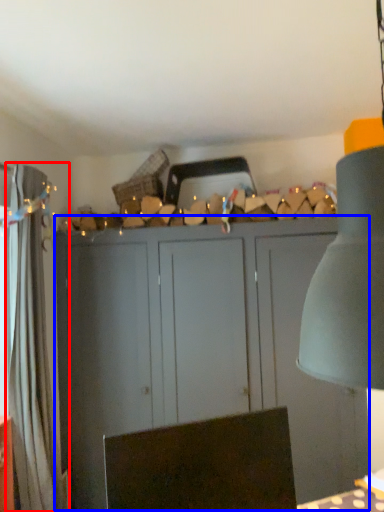
Question: Which object is further to the camera taking this photo, curtain (highlighted by a red box) or cupboard (highlighted by a blue box)?

Choices:
 (A) curtain
 (B) cupboard

Answer: (B)